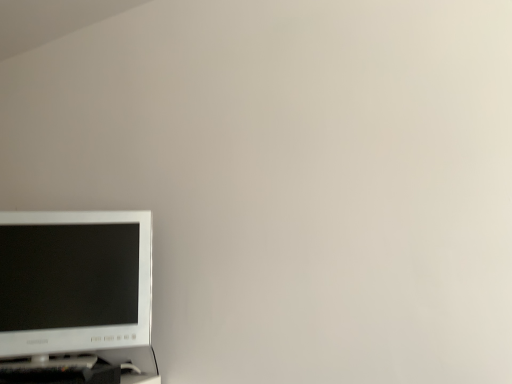
Describe the element at coordinates (77, 285) in the screenshot. I see `white glossy computer monitor at lower left` at that location.

Identify the location of white glossy computer monitor at lower left. (77, 285).

In order to face white glossy computer monitor at lower left, should I rotate leftwards or rightwards?

A 23.139 degree turn to the left will do.

This screenshot has width=512, height=384. Describe the element at coordinates (85, 369) in the screenshot. I see `black plastic computer desk at lower left` at that location.

At what (x,y) coordinates should I click in order to perform the action: click on black plastic computer desk at lower left. Please return your answer as a coordinate pair (x, y). Looking at the image, I should click on (85, 369).

I want to click on white glossy computer monitor at lower left, so click(77, 285).

Does white glossy computer monitor at lower left appear on the right side of black plastic computer desk at lower left?

Yes.

In the scene shown: Which object is closer to the camera taking this photo, white glossy computer monitor at lower left or black plastic computer desk at lower left?

black plastic computer desk at lower left is in front.

Considering the positions of points (27, 281) and (71, 359), is point (27, 281) closer to camera compared to point (71, 359)?

No, it is not.

From the image's perspective, between white glossy computer monitor at lower left and black plastic computer desk at lower left, which one is located above?

white glossy computer monitor at lower left, from the image's perspective.

From a real-world perspective, relative to black plastic computer desk at lower left, is white glossy computer monitor at lower left vertically above or below?

From a real-world perspective, white glossy computer monitor at lower left is physically above black plastic computer desk at lower left.

Consider the image. Considering the sizes of white glossy computer monitor at lower left and black plastic computer desk at lower left in the image, is white glossy computer monitor at lower left wider or thinner than black plastic computer desk at lower left?

In the image, white glossy computer monitor at lower left appears to be more narrow than black plastic computer desk at lower left.

Considering the sizes of objects white glossy computer monitor at lower left and black plastic computer desk at lower left in the image provided, who is shorter, white glossy computer monitor at lower left or black plastic computer desk at lower left?

Standing shorter between the two is black plastic computer desk at lower left.

Based on the photo, does white glossy computer monitor at lower left have a larger size compared to black plastic computer desk at lower left?

Indeed, white glossy computer monitor at lower left has a larger size compared to black plastic computer desk at lower left.

Do you think white glossy computer monitor at lower left is within black plastic computer desk at lower left, or outside of it?

The correct answer is: outside.

Are white glossy computer monitor at lower left and black plastic computer desk at lower left located far from each other?

That's not correct — white glossy computer monitor at lower left is a little close to black plastic computer desk at lower left.

Is white glossy computer monitor at lower left positioned with its back to black plastic computer desk at lower left?

That's not correct — white glossy computer monitor at lower left is not looking away from black plastic computer desk at lower left.

How different are the orientations of white glossy computer monitor at lower left and black plastic computer desk at lower left in degrees?

The angular difference between white glossy computer monitor at lower left and black plastic computer desk at lower left is 39.7 degrees.

How much distance is there between white glossy computer monitor at lower left and black plastic computer desk at lower left?

white glossy computer monitor at lower left and black plastic computer desk at lower left are 5.98 inches apart.

You are a GUI agent. You are given a task and a screenshot of the screen. Output one action in this format:
    pyautogui.click(x=<x>, y=<y>)
    Task: Click on the computer monitor above the black plastic computer desk at lower left (from a real-world perspective)
    The height and width of the screenshot is (384, 512).
    Given the screenshot: What is the action you would take?
    pyautogui.click(x=77, y=285)

Which is more to the left, black plastic computer desk at lower left or white glossy computer monitor at lower left?

From the viewer's perspective, black plastic computer desk at lower left appears more on the left side.

Looking at this image, is black plastic computer desk at lower left positioned behind white glossy computer monitor at lower left?

No, it is not.

Does point (151, 353) lie in front of point (125, 299)?

No, (151, 353) is further to viewer.

From the image's perspective, is black plastic computer desk at lower left above white glossy computer monitor at lower left?

No.

From a real-world perspective, is black plastic computer desk at lower left above or below white glossy computer monitor at lower left?

black plastic computer desk at lower left is below white glossy computer monitor at lower left.

Considering the sizes of black plastic computer desk at lower left and white glossy computer monitor at lower left in the image, is black plastic computer desk at lower left wider or thinner than white glossy computer monitor at lower left?

black plastic computer desk at lower left is wider than white glossy computer monitor at lower left.

Does black plastic computer desk at lower left have a greater height compared to white glossy computer monitor at lower left?

No, black plastic computer desk at lower left is not taller than white glossy computer monitor at lower left.

Between black plastic computer desk at lower left and white glossy computer monitor at lower left, which one has smaller size?

black plastic computer desk at lower left is smaller.

Would you say black plastic computer desk at lower left is outside white glossy computer monitor at lower left?

black plastic computer desk at lower left lies outside white glossy computer monitor at lower left's area.

Is black plastic computer desk at lower left next to white glossy computer monitor at lower left?

No, black plastic computer desk at lower left is not beside white glossy computer monitor at lower left.

Is black plastic computer desk at lower left facing away from white glossy computer monitor at lower left?

No, black plastic computer desk at lower left is not facing the opposite direction of white glossy computer monitor at lower left.

Can you tell me how much black plastic computer desk at lower left and white glossy computer monitor at lower left differ in facing direction?

The facing directions of black plastic computer desk at lower left and white glossy computer monitor at lower left are 39.7 degrees apart.

Locate an element on the screen. The width and height of the screenshot is (512, 384). computer monitor behind the black plastic computer desk at lower left is located at coordinates (77, 285).

At what (x,y) coordinates should I click in order to perform the action: click on computer monitor that appears above the black plastic computer desk at lower left (from a real-world perspective). Please return your answer as a coordinate pair (x, y). The height and width of the screenshot is (384, 512). Looking at the image, I should click on pyautogui.click(x=77, y=285).

Locate an element on the screen. computer desk on the left of white glossy computer monitor at lower left is located at coordinates (85, 369).